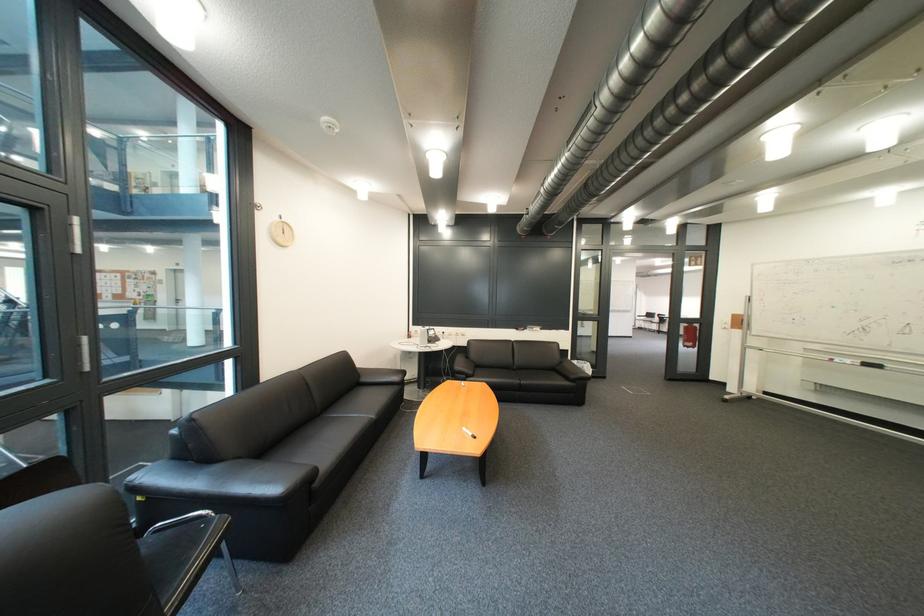
Where is `black whiteboard eraser`? This screenshot has width=924, height=616. black whiteboard eraser is located at coordinates (871, 363).